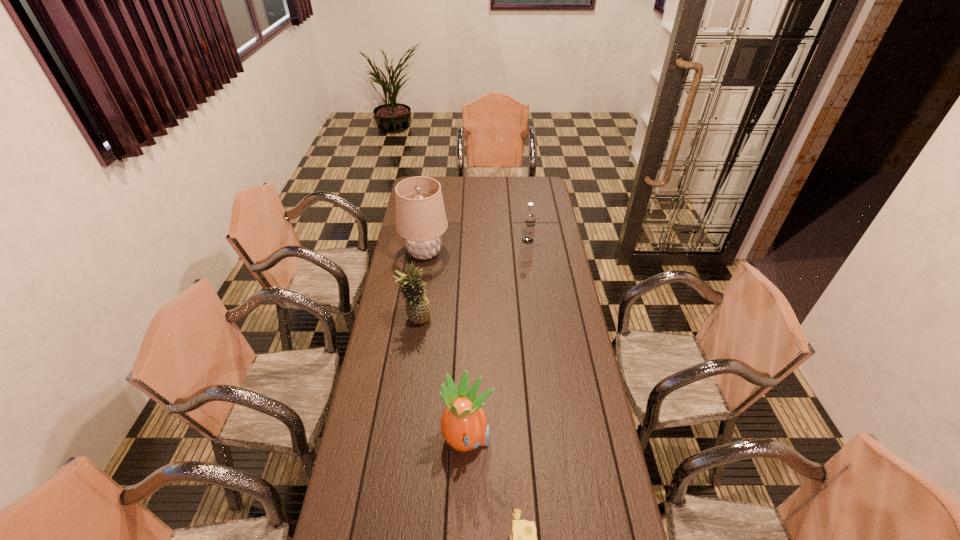
What are the coordinates of `free space between the second nearest object and the tallest object` in the screenshot? It's located at (446, 346).

Image resolution: width=960 pixels, height=540 pixels. What are the coordinates of `object that ranks as the third closest to the lampshade` in the screenshot? It's located at (464, 426).

Identify which object is the third closest to the rightmost object. Please provide its 2D coordinates. Your answer should be formatted as a tuple, i.e. [(x, y)], where the tuple contains the x and y coordinates of a point satisfying the conditions above.

[(464, 426)]

Locate an element on the screen. The width and height of the screenshot is (960, 540). free space that satisfies the following two spatial constraints: 1. on the front side of the tallest object; 2. on the right side of the third nearest object is located at coordinates [x=415, y=320].

This screenshot has height=540, width=960. I want to click on vacant space that satisfies the following two spatial constraints: 1. on the front label of the rightmost object; 2. at the entrance of the right pineapple, so click(554, 440).